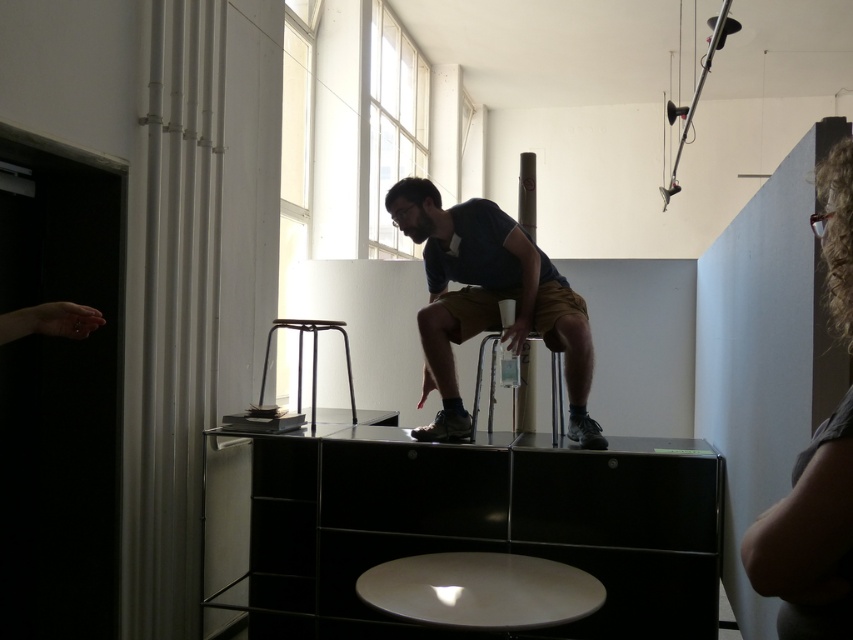
Does matte blue shirt at center appear on the left side of metallic black stool at lower center?

No, matte blue shirt at center is not to the left of metallic black stool at lower center.

Is point (444, 259) farther from viewer compared to point (314, 355)?

No, (444, 259) is closer to viewer.

The image size is (853, 640). I want to click on matte blue shirt at center, so click(x=488, y=300).

Which is more to the right, glossy black dresser at center or metallic black stool at lower center?

glossy black dresser at center

Locate an element on the screen. This screenshot has width=853, height=640. glossy black dresser at center is located at coordinates click(480, 525).

Between point (613, 605) and point (312, 419), which one is positioned in front?

Point (613, 605)

Where is `glossy black dresser at center`? Image resolution: width=853 pixels, height=640 pixels. glossy black dresser at center is located at coordinates (480, 525).

Is matte blue shirt at center taller than curly hair at upper right?

Yes.

Identify the location of matte blue shirt at center. (488, 300).

Is point (498, 268) more distant than point (814, 586)?

Yes, it is behind point (814, 586).

This screenshot has height=640, width=853. In order to click on matte blue shirt at center in this screenshot , I will do [488, 300].